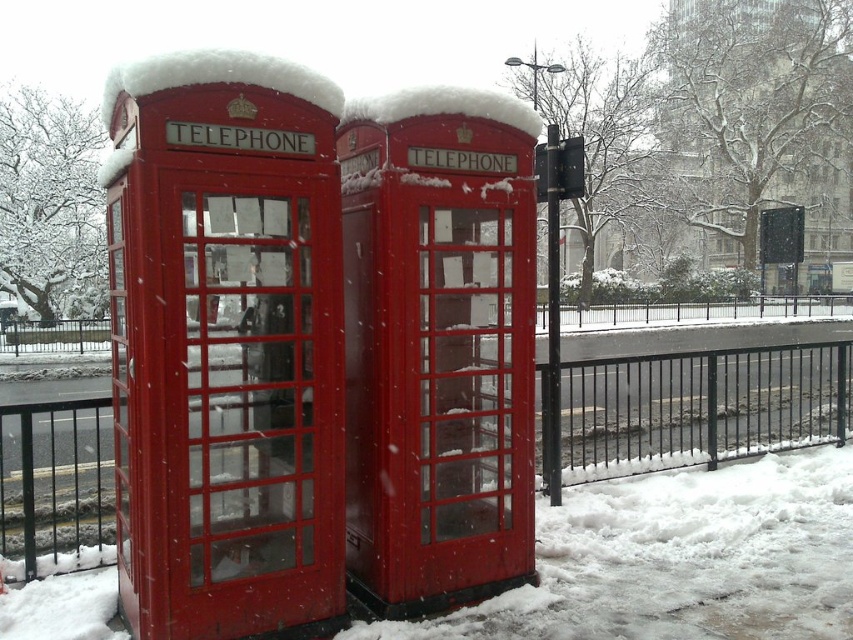
Find the location of a particular element. The height and width of the screenshot is (640, 853). matte red telephone booth at center is located at coordinates (438, 346).

What do you see at coordinates (438, 346) in the screenshot? This screenshot has height=640, width=853. I see `matte red telephone booth at center` at bounding box center [438, 346].

Where is `matte red telephone booth at center`? The width and height of the screenshot is (853, 640). matte red telephone booth at center is located at coordinates (438, 346).

Identify the location of matte red telephone booth at center. (438, 346).

What do you see at coordinates (225, 346) in the screenshot?
I see `matte red telephone at left` at bounding box center [225, 346].

Can you confirm if matte red telephone at left is bigger than matte red telephone booth at center?

Yes, matte red telephone at left is bigger than matte red telephone booth at center.

Which is in front, point (184, 172) or point (339, 156)?

Point (184, 172)

You are a GUI agent. You are given a task and a screenshot of the screen. Output one action in this format:
    pyautogui.click(x=<x>, y=<y>)
    Task: Click on the matte red telephone at left
    This screenshot has height=640, width=853.
    Given the screenshot: What is the action you would take?
    pyautogui.click(x=225, y=346)

Does matte red telephone at left have a smaller size compared to metallic black fence at lower center?

Indeed, matte red telephone at left has a smaller size compared to metallic black fence at lower center.

Is matte red telephone at left above metallic black fence at lower center?

Yes.

Which is behind, point (173, 552) or point (607, 467)?

The point (607, 467) is more distant.

Locate an element on the screen. The height and width of the screenshot is (640, 853). matte red telephone at left is located at coordinates (225, 346).